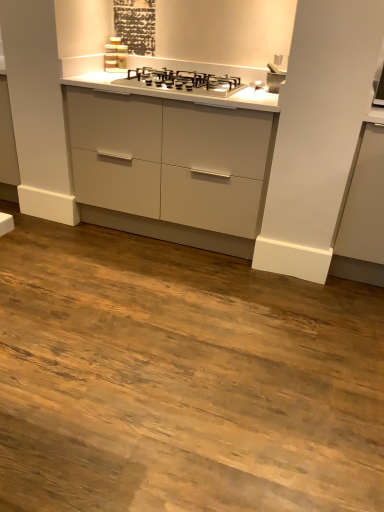
Question: Can you confirm if matte gray cabinet at right is wider than satin silver gas stove at center?

Choices:
 (A) no
 (B) yes

Answer: (B)

Question: Considering the relative sizes of matte gray cabinet at right and satin silver gas stove at center in the image provided, is matte gray cabinet at right bigger than satin silver gas stove at center?

Choices:
 (A) yes
 (B) no

Answer: (A)

Question: From a real-world perspective, is matte gray cabinet at right located higher than satin silver gas stove at center?

Choices:
 (A) yes
 (B) no

Answer: (B)

Question: Would you say matte gray cabinet at right is a long distance from satin silver gas stove at center?

Choices:
 (A) yes
 (B) no

Answer: (B)

Question: Is matte gray cabinet at right smaller than satin silver gas stove at center?

Choices:
 (A) yes
 (B) no

Answer: (B)

Question: Is point (365, 258) positioned closer to the camera than point (276, 75)?

Choices:
 (A) farther
 (B) closer

Answer: (B)

Question: In the image, is matte gray cabinet at right positioned in front of or behind satin silver faucet at upper right?

Choices:
 (A) behind
 (B) front

Answer: (B)

Question: Is matte gray cabinet at right situated inside satin silver faucet at upper right or outside?

Choices:
 (A) outside
 (B) inside

Answer: (A)

Question: Is matte gray cabinet at right to the left or to the right of satin silver faucet at upper right in the image?

Choices:
 (A) right
 (B) left

Answer: (A)

Question: Looking at their shapes, would you say satin silver faucet at upper right is wider or thinner than satin silver gas stove at center?

Choices:
 (A) thin
 (B) wide

Answer: (A)

Question: Is satin silver faucet at upper right to the left or to the right of satin silver gas stove at center in the image?

Choices:
 (A) right
 (B) left

Answer: (A)

Question: From a real-world perspective, relative to satin silver gas stove at center, is satin silver faucet at upper right vertically above or below?

Choices:
 (A) above
 (B) below

Answer: (A)

Question: Choose the correct answer: Is satin silver faucet at upper right inside satin silver gas stove at center or outside it?

Choices:
 (A) outside
 (B) inside

Answer: (A)

Question: In terms of size, does satin silver gas stove at center appear bigger or smaller than matte gray cabinet at right?

Choices:
 (A) big
 (B) small

Answer: (B)

Question: In terms of width, does satin silver gas stove at center look wider or thinner when compared to matte gray cabinet at right?

Choices:
 (A) wide
 (B) thin

Answer: (B)